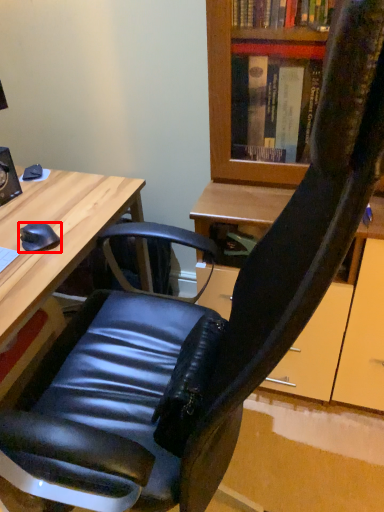
Question: From the image, what is the correct spatial relationship of mouse (annotated by the red box) in relation to desk?

Choices:
 (A) right
 (B) left

Answer: (A)